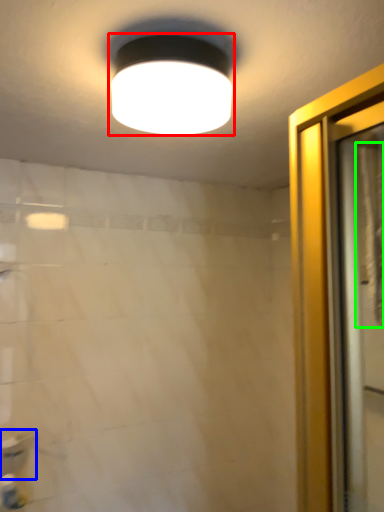
Question: Which is farther away from lamp (highlighted by a red box)? sink (highlighted by a blue box) or shower curtain (highlighted by a green box)?

Choices:
 (A) sink
 (B) shower curtain

Answer: (A)